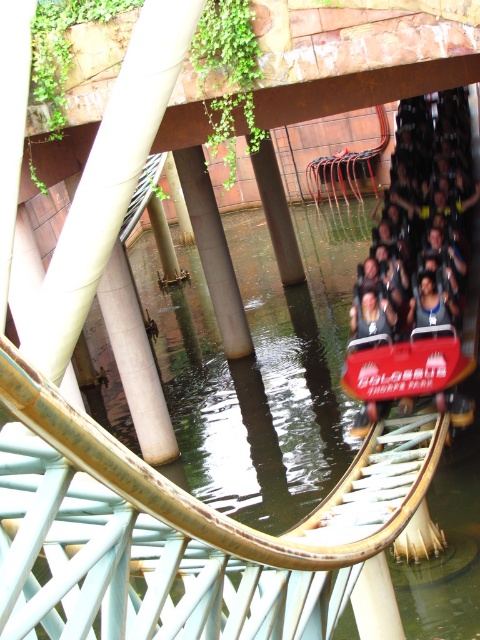
Who is shorter, brown concrete pillar at center or concrete pillar at center?

concrete pillar at center is shorter.

Who is positioned more to the right, brown concrete pillar at center or concrete pillar at center?

Positioned to the right is concrete pillar at center.

Locate an element on the screen. The height and width of the screenshot is (640, 480). brown concrete pillar at center is located at coordinates (214, 252).

Does matte red roller coaster car at center appear over concrete pillar at center?

Incorrect, matte red roller coaster car at center is not positioned above concrete pillar at center.

Image resolution: width=480 pixels, height=640 pixels. What do you see at coordinates (420, 268) in the screenshot?
I see `matte red roller coaster car at center` at bounding box center [420, 268].

Find the location of a particular element. matte red roller coaster car at center is located at coordinates (420, 268).

The image size is (480, 640). What do you see at coordinates (420, 268) in the screenshot?
I see `matte red roller coaster car at center` at bounding box center [420, 268].

This screenshot has width=480, height=640. I want to click on matte red roller coaster car at center, so click(x=420, y=268).

Is point (479, 189) closer to viewer compared to point (197, 177)?

Yes, it is.

At what (x,y) coordinates should I click in order to perform the action: click on matte red roller coaster car at center. Please return your answer as a coordinate pair (x, y). Looking at the image, I should click on (420, 268).